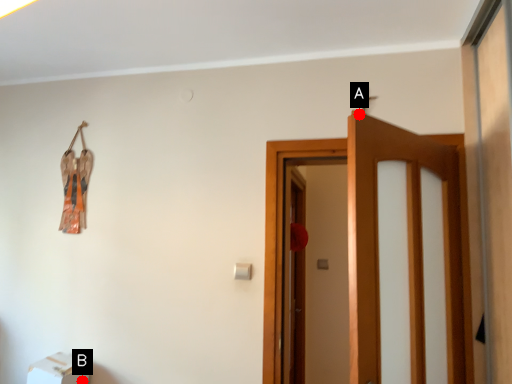
Question: Two points are circled on the image, labeled by A and B beside each circle. Which point is closer to the camera?

Choices:
 (A) A is closer
 (B) B is closer

Answer: (A)